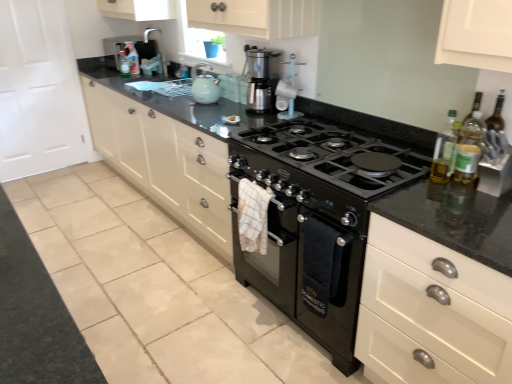
Question: Is matte white coffee maker at upper center wider than brushed metal faucet at upper center?

Choices:
 (A) no
 (B) yes

Answer: (A)

Question: Is matte white coffee maker at upper center not inside brushed metal faucet at upper center?

Choices:
 (A) yes
 (B) no

Answer: (A)

Question: Is matte white coffee maker at upper center in front of brushed metal faucet at upper center?

Choices:
 (A) yes
 (B) no

Answer: (A)

Question: From the image's perspective, is matte white coffee maker at upper center over brushed metal faucet at upper center?

Choices:
 (A) yes
 (B) no

Answer: (B)

Question: Is matte white coffee maker at upper center thinner than brushed metal faucet at upper center?

Choices:
 (A) yes
 (B) no

Answer: (A)

Question: Is matte white coffee maker at upper center at the left side of brushed metal faucet at upper center?

Choices:
 (A) no
 (B) yes

Answer: (A)

Question: From the image's perspective, is translucent plastic bottle at upper center, which ranks as the 2th bottle in back-to-front order, below translucent plastic bottle at right, acting as the second bottle starting from the right?

Choices:
 (A) yes
 (B) no

Answer: (B)

Question: Is translucent plastic bottle at upper center, which ranks as the fourth bottle in bottom-to-top order, positioned behind translucent plastic bottle at right, acting as the 2th bottle starting from the front?

Choices:
 (A) yes
 (B) no

Answer: (A)

Question: Does translucent plastic bottle at upper center, which ranks as the 2th bottle in back-to-front order, have a smaller size compared to translucent plastic bottle at right, acting as the 2th bottle starting from the front?

Choices:
 (A) no
 (B) yes

Answer: (B)

Question: Could you tell me if translucent plastic bottle at upper center, the fourth bottle from the front, is turned towards translucent plastic bottle at right, acting as the 4th bottle starting from the top?

Choices:
 (A) no
 (B) yes

Answer: (A)

Question: Can you confirm if translucent plastic bottle at upper center, which is counted as the 1th bottle, starting from the left, is taller than translucent plastic bottle at right, acting as the fourth bottle starting from the back?

Choices:
 (A) yes
 (B) no

Answer: (B)

Question: From the image's perspective, would you say translucent plastic bottle at upper center, the fifth bottle when ordered from right to left, is positioned over translucent plastic bottle at right, acting as the 4th bottle starting from the top?

Choices:
 (A) yes
 (B) no

Answer: (A)

Question: Can you confirm if matte white cabinets at center is taller than translucent plastic bottle at upper center, the third bottle in the left-to-right sequence?

Choices:
 (A) no
 (B) yes

Answer: (B)